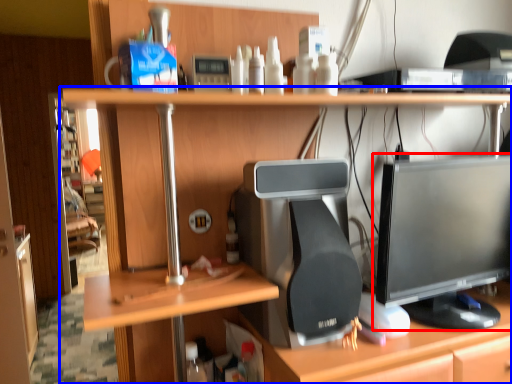
Question: Which point is closer to the camera, computer monitor (highlighted by a red box) or desk (highlighted by a blue box)?

Choices:
 (A) computer monitor
 (B) desk

Answer: (B)